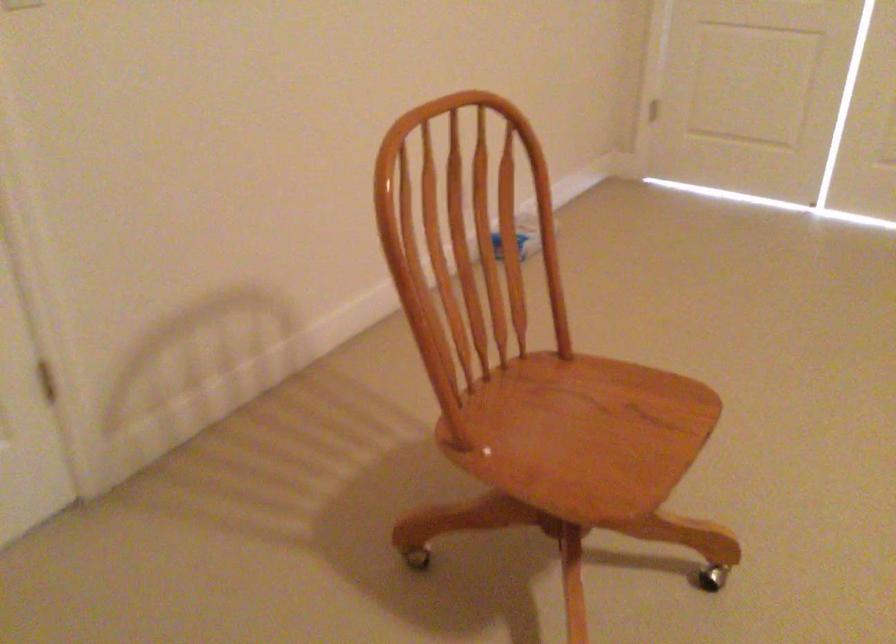
You are a GUI agent. You are given a task and a screenshot of the screen. Output one action in this format:
    pyautogui.click(x=<x>, y=<y>)
    Task: Click on the chair sitting surface
    This screenshot has height=644, width=896.
    Given the screenshot: What is the action you would take?
    pyautogui.click(x=565, y=436)